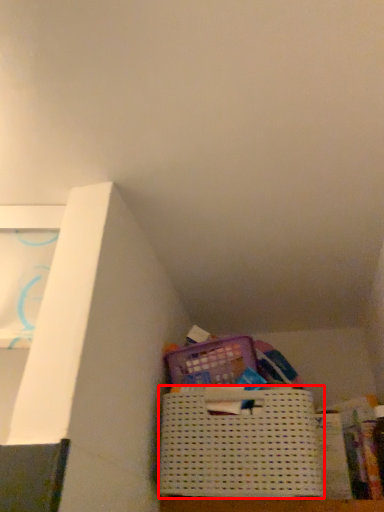
Question: Considering the relative positions of basket (annotated by the red box) and paperback book in the image provided, where is basket (annotated by the red box) located with respect to the staircase?

Choices:
 (A) left
 (B) right

Answer: (A)